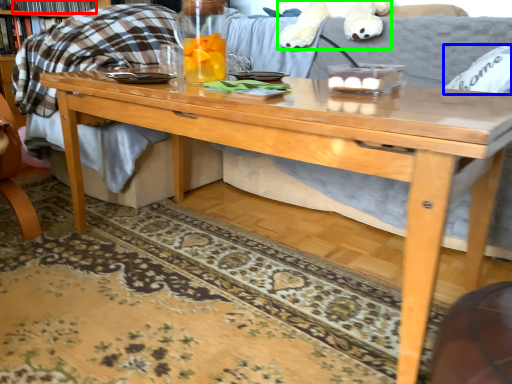
Question: Estimate the real-world distances between objects in this image. Which object is closer to book (highlighted by a red box), pillow (highlighted by a blue box) or animal (highlighted by a green box)?

Choices:
 (A) pillow
 (B) animal

Answer: (B)